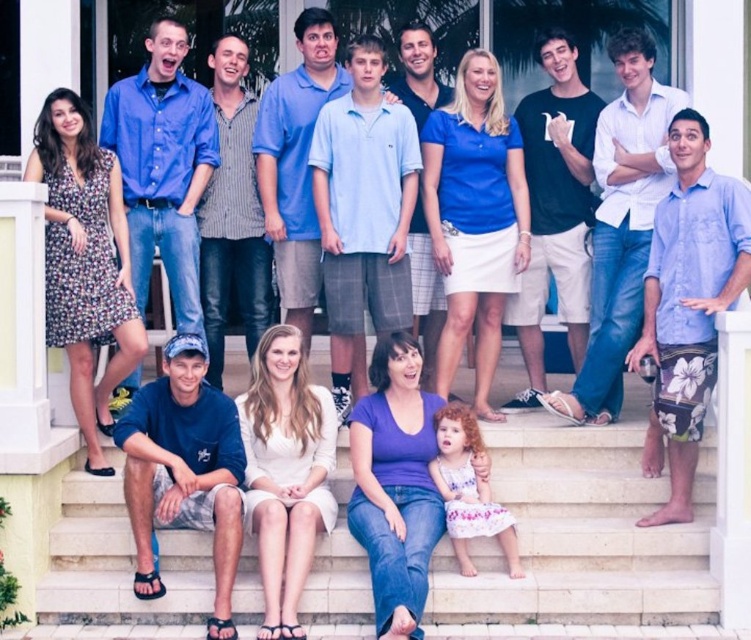
Question: Among these objects, which one is nearest to the camera?

Choices:
 (A) blue button-down shirt at upper left
 (B) white stone stairs at lower center

Answer: (B)

Question: Considering the relative positions of white stone stairs at lower center and blue button-down shirt at upper left in the image provided, where is white stone stairs at lower center located with respect to blue button-down shirt at upper left?

Choices:
 (A) above
 (B) below

Answer: (B)

Question: Which point appears closest to the camera in this image?

Choices:
 (A) (176, 113)
 (B) (540, 465)

Answer: (B)

Question: Is white stone stairs at lower center to the left of blue button-down shirt at upper left from the viewer's perspective?

Choices:
 (A) yes
 (B) no

Answer: (B)

Question: Which object is farther from the camera taking this photo?

Choices:
 (A) blue button-down shirt at upper left
 (B) white stone stairs at lower center

Answer: (A)

Question: Is white stone stairs at lower center bigger than blue button-down shirt at upper left?

Choices:
 (A) yes
 (B) no

Answer: (A)